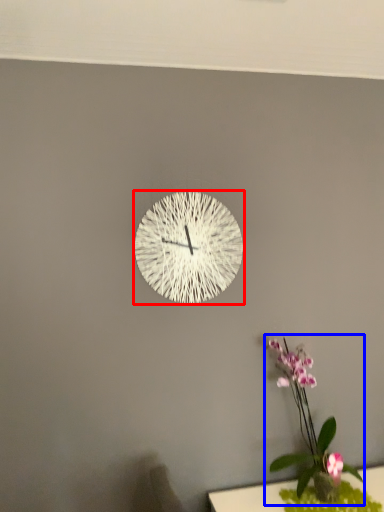
Question: Which object is further to the camera taking this photo, wall clock (highlighted by a red box) or floral arrangement (highlighted by a blue box)?

Choices:
 (A) wall clock
 (B) floral arrangement

Answer: (A)